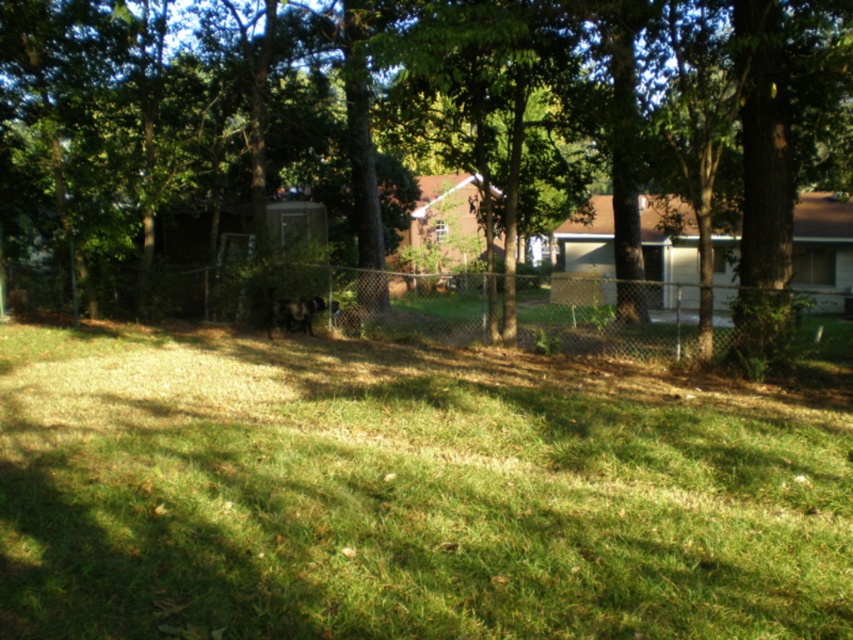
Question: Can you confirm if green grassy at center is bigger than green leafy tree at center?

Choices:
 (A) yes
 (B) no

Answer: (B)

Question: Is green grassy at center positioned at the back of green leafy tree at center?

Choices:
 (A) no
 (B) yes

Answer: (A)

Question: Which point is closer to the camera?

Choices:
 (A) green grassy at center
 (B) green leafy tree at center

Answer: (A)

Question: Which point appears farthest from the camera in this image?

Choices:
 (A) (316, 369)
 (B) (283, 241)

Answer: (B)

Question: Is green grassy at center to the right of green leafy tree at center from the viewer's perspective?

Choices:
 (A) no
 (B) yes

Answer: (A)